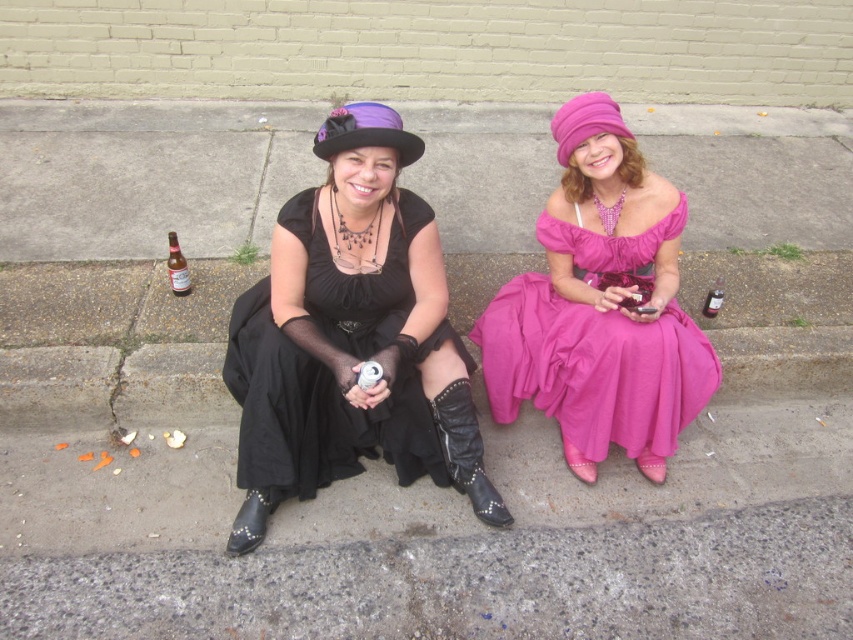
Is pink felt hat at upper right above brown glass bottle at lower left?

Correct, pink felt hat at upper right is located above brown glass bottle at lower left.

Is pink felt hat at upper right below brown glass bottle at lower left?

No, pink felt hat at upper right is not below brown glass bottle at lower left.

Locate an element on the screen. pink felt hat at upper right is located at coordinates (585, 122).

Who is more forward, (396, 140) or (592, 125)?

Point (396, 140) is in front.

Is purple felt hat at center smaller than pink felt hat at upper right?

Correct, purple felt hat at center occupies less space than pink felt hat at upper right.

The width and height of the screenshot is (853, 640). Describe the element at coordinates (366, 132) in the screenshot. I see `purple felt hat at center` at that location.

Identify the location of purple felt hat at center. [x=366, y=132].

Between studded leather boot at lower center and brown glass bottle at lower left, which one has less height?

Standing shorter between the two is brown glass bottle at lower left.

Does studded leather boot at lower center appear on the left side of brown glass bottle at lower left?

Incorrect, studded leather boot at lower center is not on the left side of brown glass bottle at lower left.

You are a GUI agent. You are given a task and a screenshot of the screen. Output one action in this format:
    pyautogui.click(x=<x>, y=<y>)
    Task: Click on the studded leather boot at lower center
    Image resolution: width=853 pixels, height=640 pixels.
    Given the screenshot: What is the action you would take?
    pyautogui.click(x=466, y=451)

You are a GUI agent. You are given a task and a screenshot of the screen. Output one action in this format:
    pyautogui.click(x=<x>, y=<y>)
    Task: Click on the studded leather boot at lower center
    
    Given the screenshot: What is the action you would take?
    pyautogui.click(x=466, y=451)